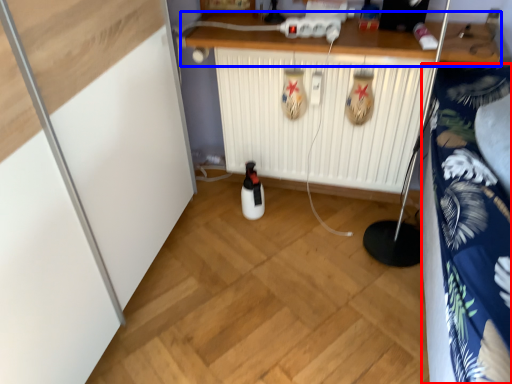
Question: Which point is further to the camera, bedding (highlighted by a red box) or counter (highlighted by a blue box)?

Choices:
 (A) bedding
 (B) counter

Answer: (B)